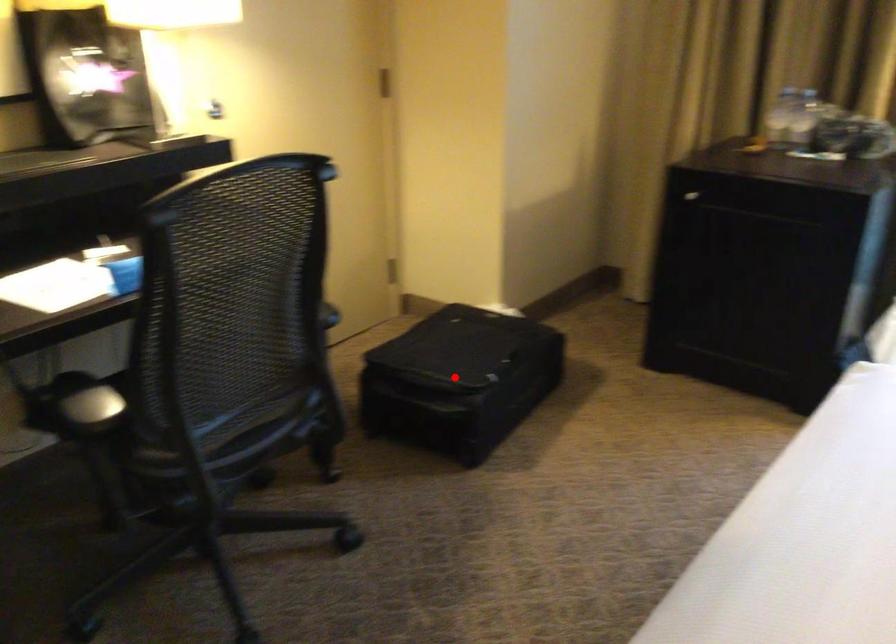
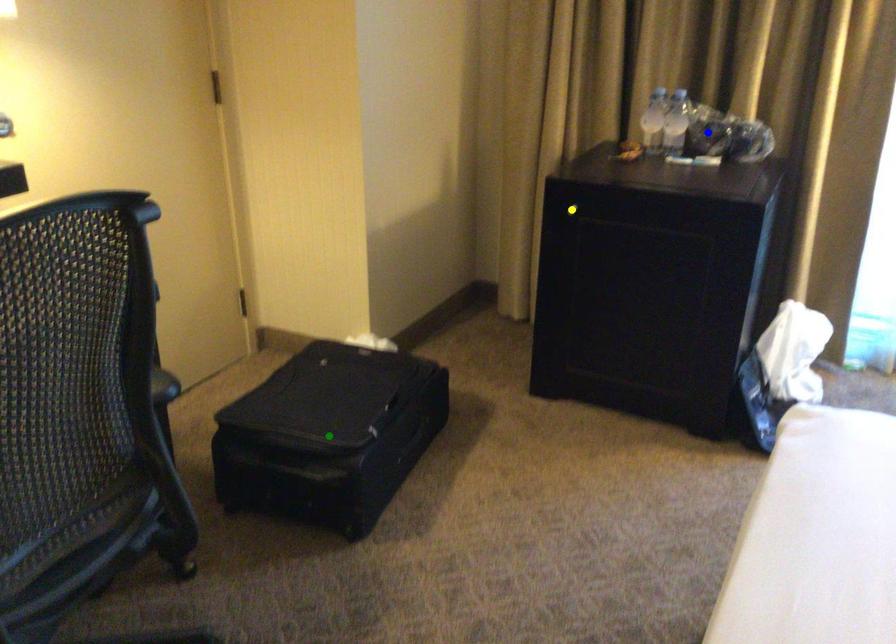
Question: I am providing you with two images of the same scene from different viewpoints. A red point is marked on the first image. You are given multiple points on the second image. Which spot in image 2 lines up with the point in image 1?

Choices:
 (A) green point
 (B) yellow point
 (C) blue point

Answer: (A)